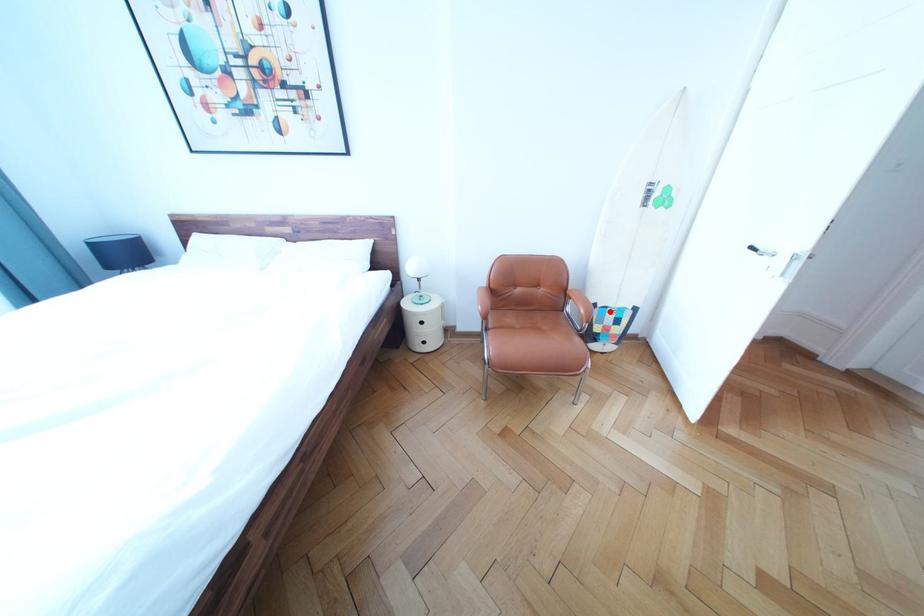
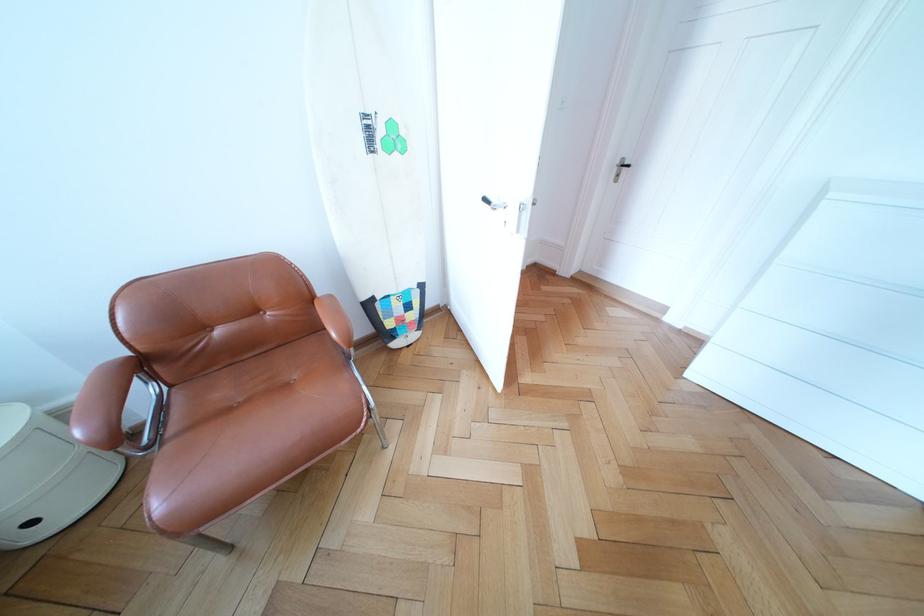
Where in the second image is the point corresponding to the highlighted location from the first image?

(390, 304)